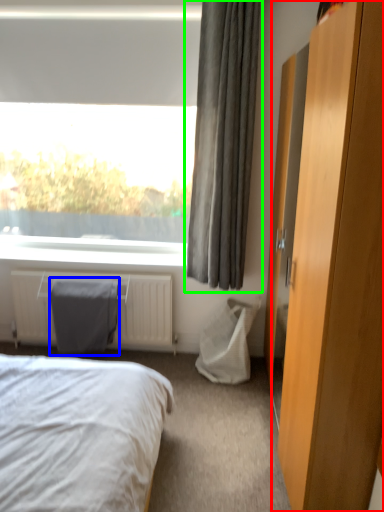
Question: Estimate the real-world distances between objects in this image. Which object is closer to dresser (highlighted by a red box), gray (highlighted by a blue box) or curtain (highlighted by a green box)?

Choices:
 (A) gray
 (B) curtain

Answer: (B)